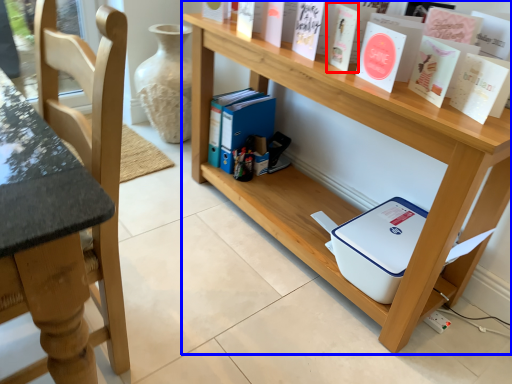
Question: Which object is further to the camera taking this photo, paperback book (highlighted by a red box) or shelf (highlighted by a blue box)?

Choices:
 (A) paperback book
 (B) shelf

Answer: (A)